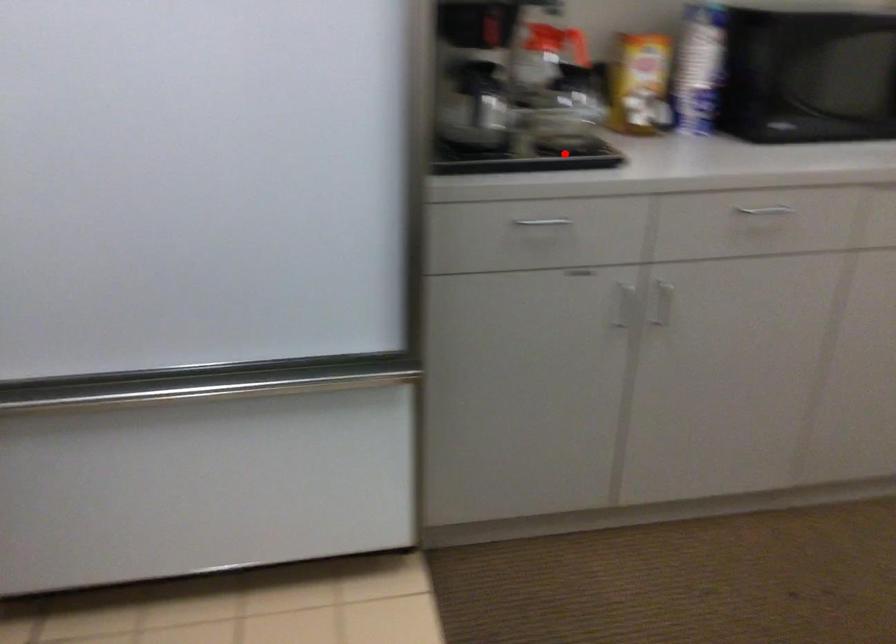
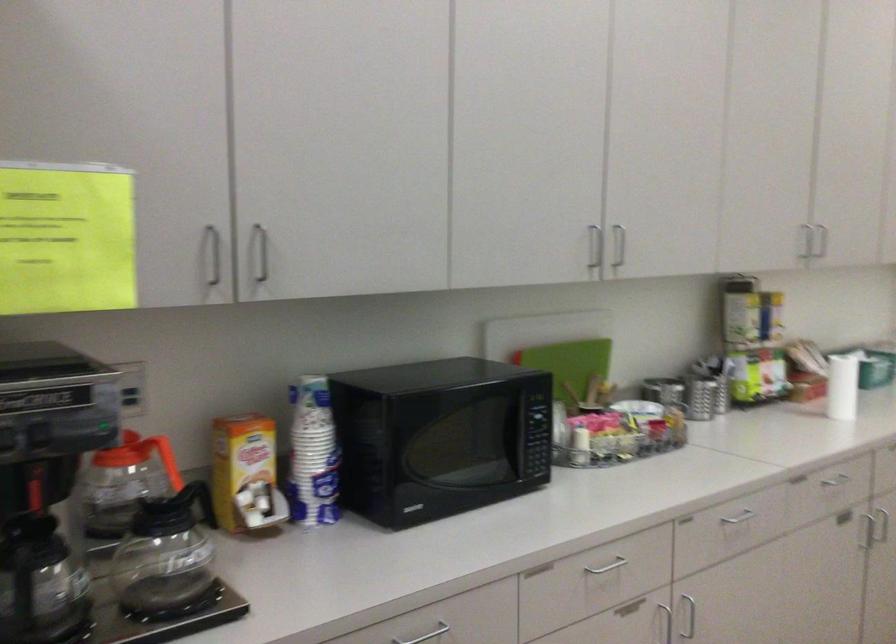
Question: I am providing you with two images of the same scene from different viewpoints. In image1, a red point is highlighted. Considering the same 3D point in image2, which of the following is correct?

Choices:
 (A) It is closer
 (B) It is farther

Answer: (A)